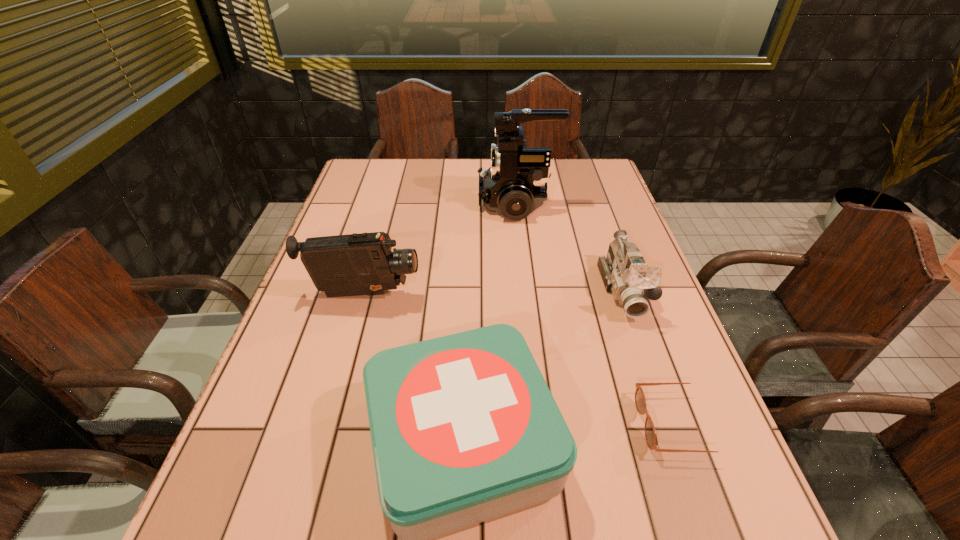
Find the location of a particular element. vacant space located 0.100m on the front-facing side of the rightmost camcorder is located at coordinates (648, 359).

Locate an element on the screen. vacant space located on the front-facing side of the shortest object is located at coordinates (473, 424).

Identify the location of vacant space located 0.100m on the front-facing side of the shortest object. The width and height of the screenshot is (960, 540). [587, 424].

Where is `free point located on the front-facing side of the shortest object`? This screenshot has height=540, width=960. free point located on the front-facing side of the shortest object is located at coordinates pyautogui.click(x=430, y=424).

Where is `object that is at the far edge`? The image size is (960, 540). object that is at the far edge is located at coordinates (515, 185).

Where is `object at the left edge`? object at the left edge is located at coordinates (355, 264).

Find the location of `camcorder present at the right edge`. camcorder present at the right edge is located at coordinates (625, 274).

Find the location of a particular element. This screenshot has height=540, width=960. sunglasses at the right edge is located at coordinates (640, 401).

The width and height of the screenshot is (960, 540). In order to click on free space at the far edge of the desktop in this screenshot , I will do `click(480, 167)`.

The width and height of the screenshot is (960, 540). I want to click on vacant space at the left edge of the desktop, so click(361, 203).